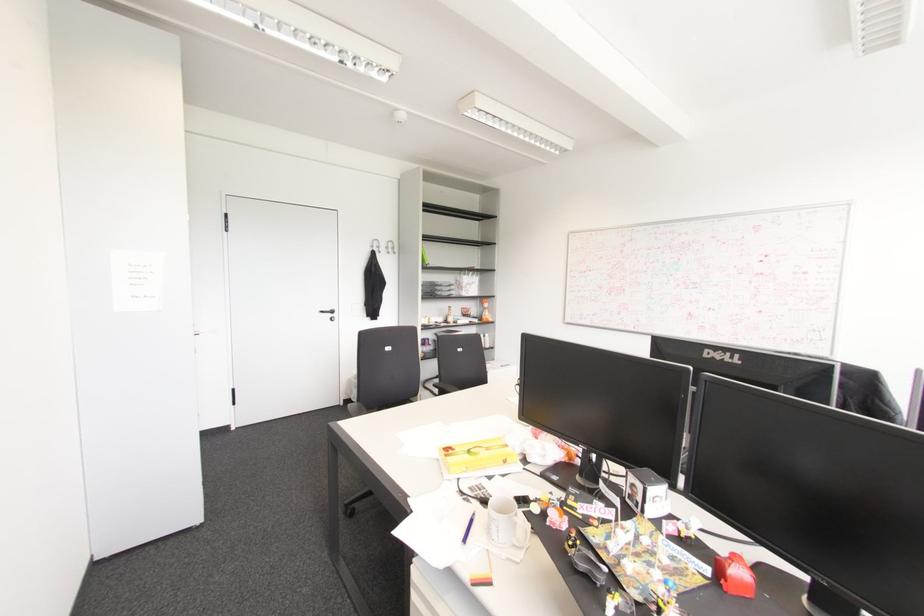
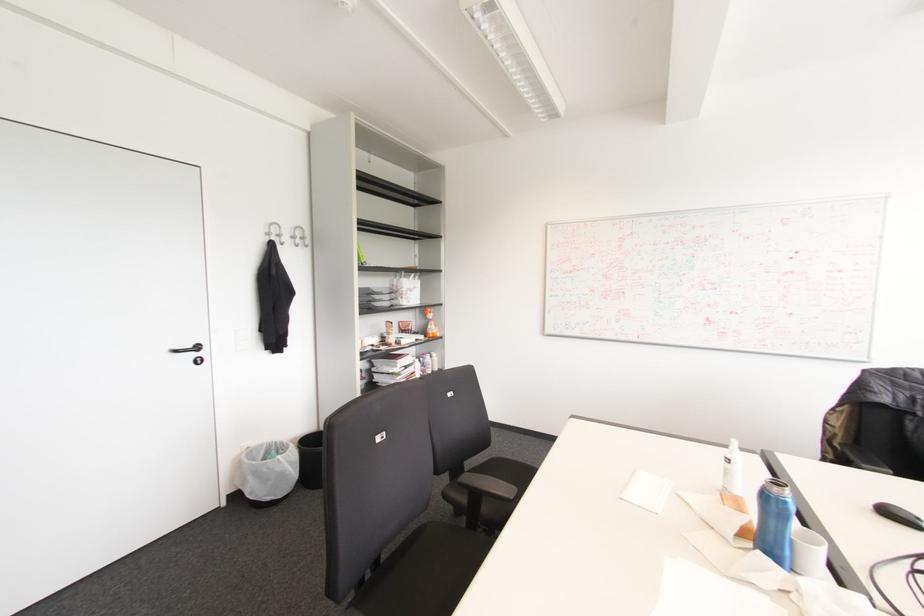
Locate, in the second image, the point that corresponds to point 392,248 in the first image.

(301, 238)